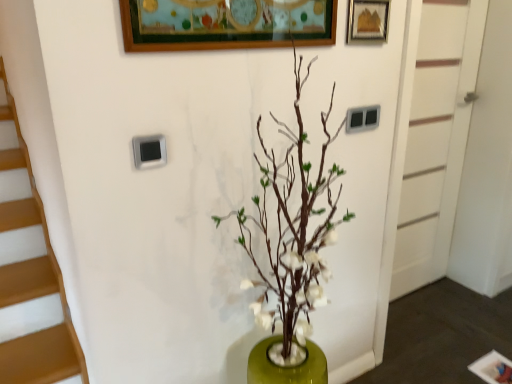
Question: Considering the positions of white painted wood door at right and green matte vase at center in the image, is white painted wood door at right bigger or smaller than green matte vase at center?

Choices:
 (A) big
 (B) small

Answer: (B)

Question: Visually, is white painted wood door at right positioned to the left or to the right of green matte vase at center?

Choices:
 (A) left
 (B) right

Answer: (B)

Question: Which object is positioned farthest from the green matte vase at center?

Choices:
 (A) white painted wood door at right
 (B) wooden picture frame at upper right

Answer: (A)

Question: Which object is positioned closest to the white painted wood door at right?

Choices:
 (A) wooden picture frame at upper right
 (B) green matte vase at center

Answer: (A)